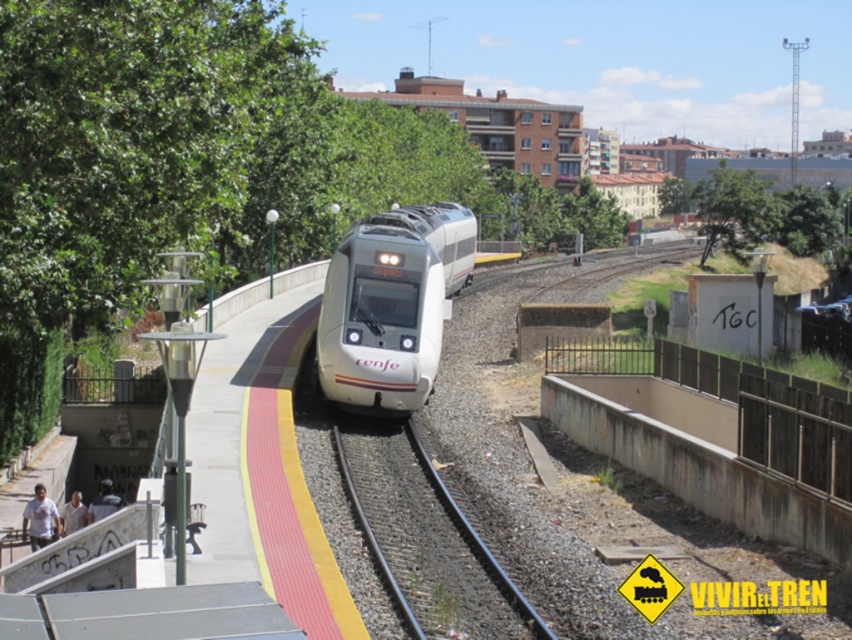
Who is more forward, (381, 333) or (706, 212)?

Point (381, 333)

Which is in front, point (448, 208) or point (806, 237)?

Point (448, 208) is in front.

Find the location of a particular element. white glossy bullet train at center is located at coordinates (390, 305).

Identify the location of black metal train track at center. This screenshot has width=852, height=640. (426, 540).

Does black metal train track at center appear on the right side of green leafy tree at upper right?

In fact, black metal train track at center is to the left of green leafy tree at upper right.

Is point (513, 612) positioned in front of point (726, 225)?

Yes, point (513, 612) is closer to viewer.

This screenshot has width=852, height=640. Find the location of `black metal train track at center`. black metal train track at center is located at coordinates (426, 540).

Which is more to the right, white glossy bullet train at center or black metal train track at center?

white glossy bullet train at center

Which is below, white glossy bullet train at center or black metal train track at center?

black metal train track at center

Describe the element at coordinates (390, 305) in the screenshot. I see `white glossy bullet train at center` at that location.

This screenshot has width=852, height=640. Find the location of `white glossy bullet train at center`. white glossy bullet train at center is located at coordinates (390, 305).